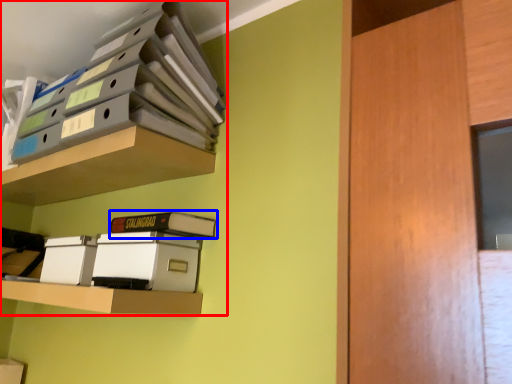
Question: Which point is further to the camera, shelf (highlighted by a red box) or paperback book (highlighted by a blue box)?

Choices:
 (A) shelf
 (B) paperback book

Answer: (B)